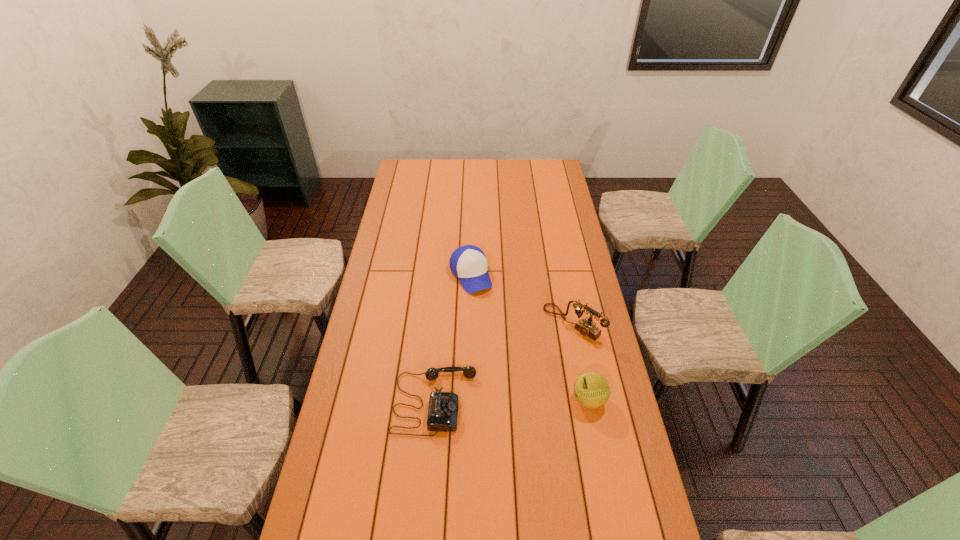
Identify the location of the nearer telephone. The image size is (960, 540). (443, 407).

Where is `the shorter telephone`? the shorter telephone is located at coordinates (443, 407).

Identify the location of softball. (591, 389).

The width and height of the screenshot is (960, 540). Identify the location of the right telephone. coord(586,327).

You are a GUI agent. You are given a task and a screenshot of the screen. Output one action in this format:
    pyautogui.click(x=<x>, y=<y>)
    Task: Click on the taller telephone
    This screenshot has height=540, width=960.
    Given the screenshot: What is the action you would take?
    (x=586, y=327)

Where is `baseball cap`? baseball cap is located at coordinates (468, 263).

The image size is (960, 540). I want to click on vacant space located 0.080m on the dial of the nearer telephone, so click(x=501, y=402).

Where is `vacant region located on the logo side of the softball`? vacant region located on the logo side of the softball is located at coordinates (473, 400).

Where is `vacant space situated 0.060m on the logo side of the softball`? vacant space situated 0.060m on the logo side of the softball is located at coordinates (553, 400).

Identify the location of free space located on the logo side of the softball. Image resolution: width=960 pixels, height=540 pixels. pos(489,400).